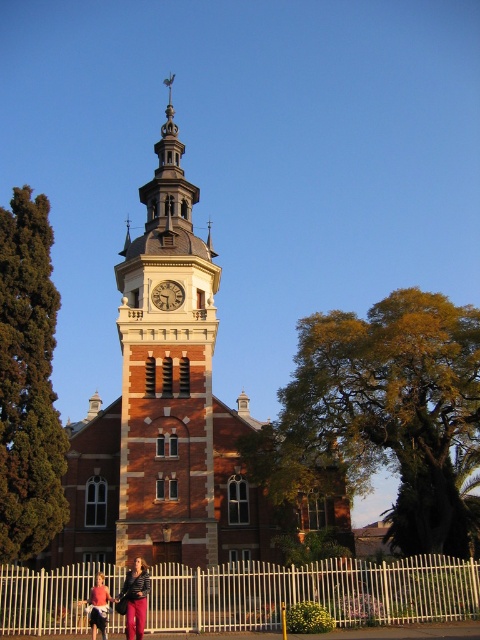
Looking at this image, measure the distance from brown brick church at center to white metal fence at lower center.

brown brick church at center and white metal fence at lower center are 16.52 meters apart.

Who is more distant from viewer, (167,404) or (455,570)?

Point (167,404)

Image resolution: width=480 pixels, height=640 pixels. Find the location of `brown brick church at center`. brown brick church at center is located at coordinates (175, 417).

Image resolution: width=480 pixels, height=640 pixels. Identify the location of brown brick church at center. (175, 417).

Can you confirm if white metal fence at lower center is shorter than matte black jacket at lower left?

No, white metal fence at lower center is not shorter than matte black jacket at lower left.

Does point (37, 592) come behind point (141, 589)?

Yes, it is behind point (141, 589).

The image size is (480, 640). In order to click on white metal fence at lower center in this screenshot , I will do `click(312, 593)`.

Is matte black jacket at lower left smaller than wooden clock at center?

Correct, matte black jacket at lower left occupies less space than wooden clock at center.

Does point (143, 580) come behind point (181, 300)?

No, it is not.

Where is `matte black jacket at lower left`? matte black jacket at lower left is located at coordinates (134, 598).